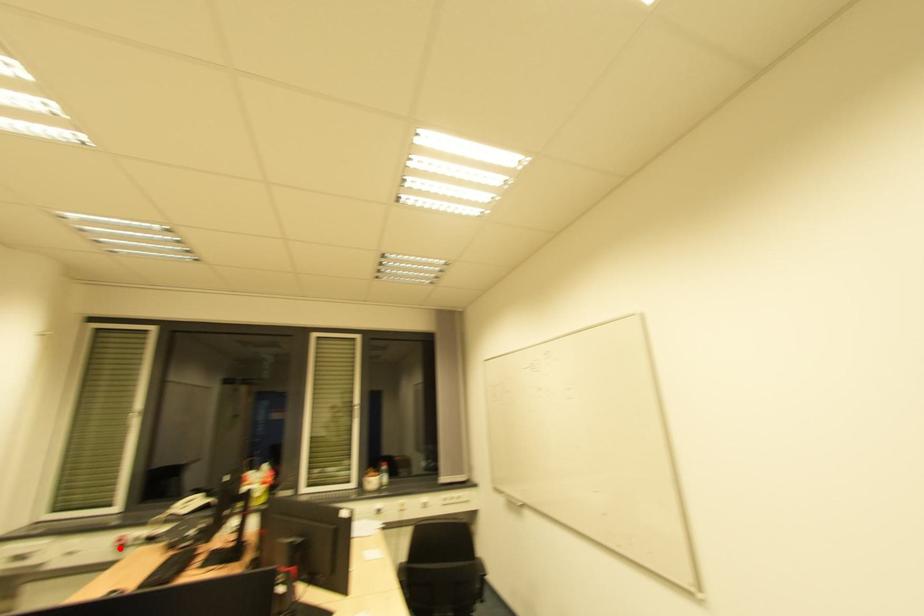
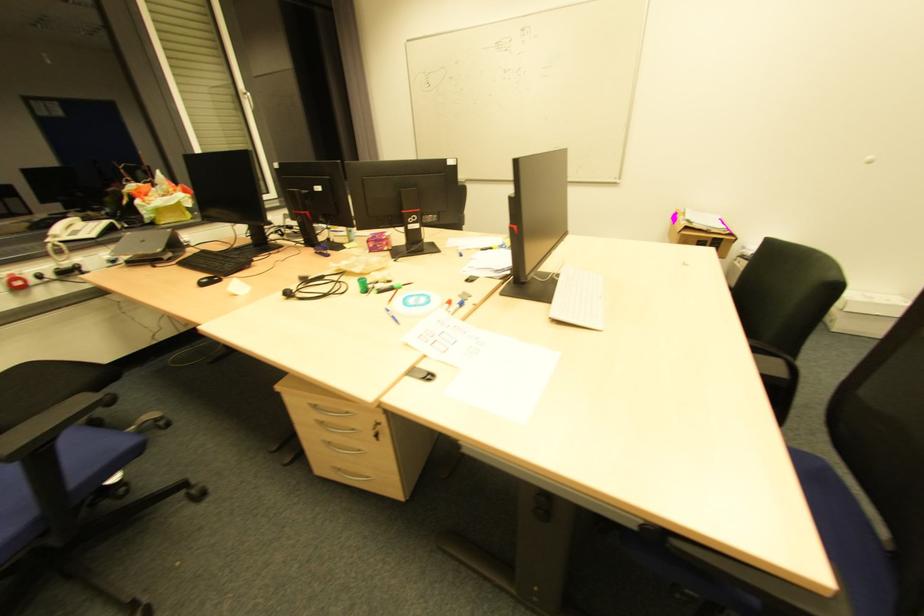
Question: A red point is marked in image1. In image2, is the corresponding 3D point closer to the camera or farther? Reply with the corresponding letter.

Choices:
 (A) The corresponding 3D point is closer.
 (B) The corresponding 3D point is farther.

Answer: (B)